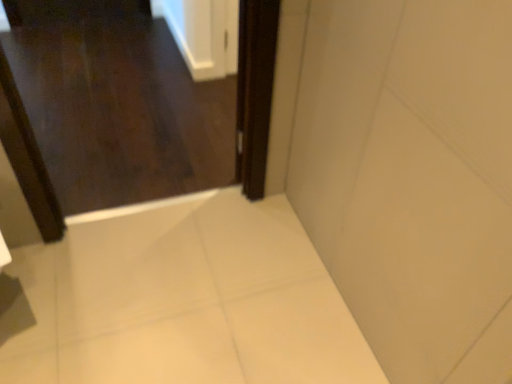
Question: Does dark wood screen door at center have a greater height compared to dark wood door at upper left?

Choices:
 (A) no
 (B) yes

Answer: (B)

Question: Is dark wood screen door at center far from dark wood door at upper left?

Choices:
 (A) yes
 (B) no

Answer: (A)

Question: Is dark wood screen door at center bigger than dark wood door at upper left?

Choices:
 (A) no
 (B) yes

Answer: (A)

Question: Considering the relative sizes of dark wood screen door at center and dark wood door at upper left in the image provided, is dark wood screen door at center wider than dark wood door at upper left?

Choices:
 (A) no
 (B) yes

Answer: (A)

Question: From a real-world perspective, is dark wood screen door at center positioned under dark wood door at upper left based on gravity?

Choices:
 (A) yes
 (B) no

Answer: (B)

Question: From a real-world perspective, is dark wood screen door at center positioned over dark wood door at upper left based on gravity?

Choices:
 (A) yes
 (B) no

Answer: (A)

Question: Does dark wood door at upper left lie behind dark wood screen door at center?

Choices:
 (A) no
 (B) yes

Answer: (B)

Question: From a real-world perspective, does dark wood door at upper left sit lower than dark wood screen door at center?

Choices:
 (A) yes
 (B) no

Answer: (A)

Question: Considering the relative positions of dark wood door at upper left and dark wood screen door at center in the image provided, is dark wood door at upper left to the right of dark wood screen door at center from the viewer's perspective?

Choices:
 (A) no
 (B) yes

Answer: (A)

Question: Is dark wood door at upper left taller than dark wood screen door at center?

Choices:
 (A) no
 (B) yes

Answer: (A)

Question: Is dark wood door at upper left looking in the opposite direction of dark wood screen door at center?

Choices:
 (A) yes
 (B) no

Answer: (B)

Question: From the image's perspective, does dark wood door at upper left appear higher than dark wood screen door at center?

Choices:
 (A) no
 (B) yes

Answer: (B)

Question: Is point (206, 177) closer or farther from the camera than point (263, 62)?

Choices:
 (A) closer
 (B) farther

Answer: (B)